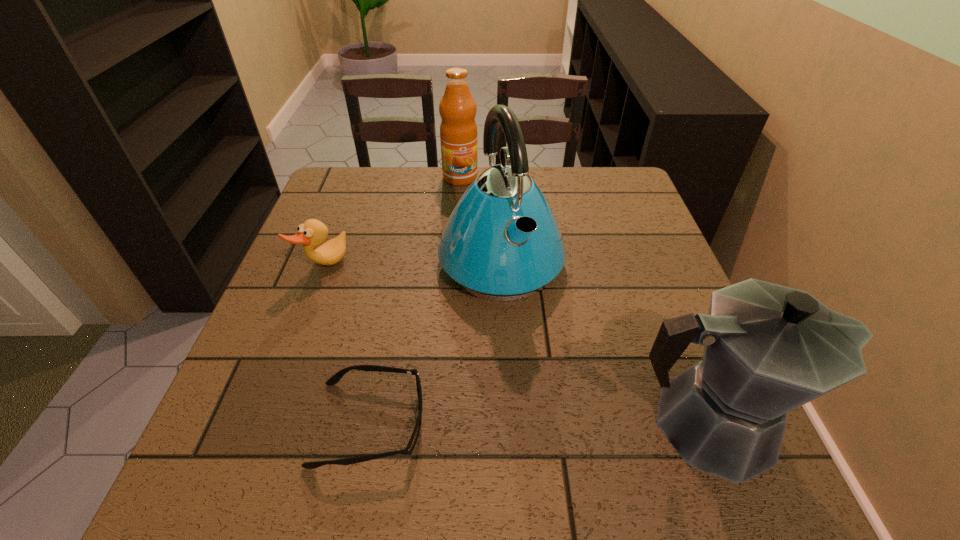
You are a GUI agent. You are given a task and a screenshot of the screen. Output one action in this format:
    pyautogui.click(x=<x>, y=<y>)
    Task: Click on the shortest object
    
    Given the screenshot: What is the action you would take?
    pyautogui.click(x=334, y=379)

You are a GUI agent. You are given a task and a screenshot of the screen. Output one action in this format:
    pyautogui.click(x=<x>, y=<y>)
    Task: Click on the coffeepot
    The width and height of the screenshot is (960, 540).
    Given the screenshot: What is the action you would take?
    (x=768, y=349)

Identify the location of the farthest object. The width and height of the screenshot is (960, 540). (458, 130).

At what (x,y) coordinates should I click in order to perform the action: click on the leftmost object. Please return your answer as a coordinate pair (x, y). Looking at the image, I should click on (312, 233).

Find the location of a particular element. This screenshot has width=960, height=540. the fourth tallest object is located at coordinates (312, 233).

I want to click on kettle, so click(502, 242).

At what (x,y) coordinates should I click in order to perform the action: click on vacant space situated on the front-facing side of the spectacles. Please return your answer as a coordinate pair (x, y). Looking at the image, I should click on (459, 423).

This screenshot has height=540, width=960. Identify the location of vacant space located 0.330m on the label side of the farthest object. [481, 261].

Identify the location of blank space located 0.150m on the label side of the farthest object. The height and width of the screenshot is (540, 960). (469, 217).

Find the location of `free spot located 0.170m on the label side of the farthest object`. free spot located 0.170m on the label side of the farthest object is located at coordinates (471, 221).